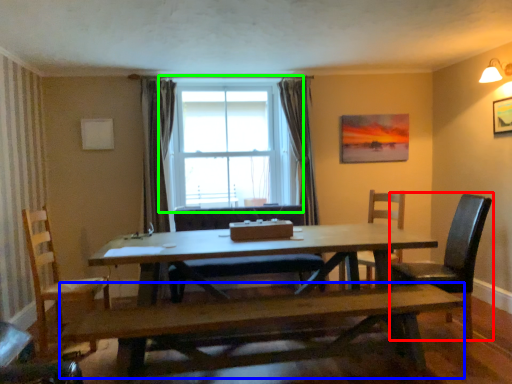
Question: Which is nearer to the chair (highlighted by a red box)? bench (highlighted by a blue box) or window (highlighted by a green box).

Choices:
 (A) bench
 (B) window

Answer: (A)